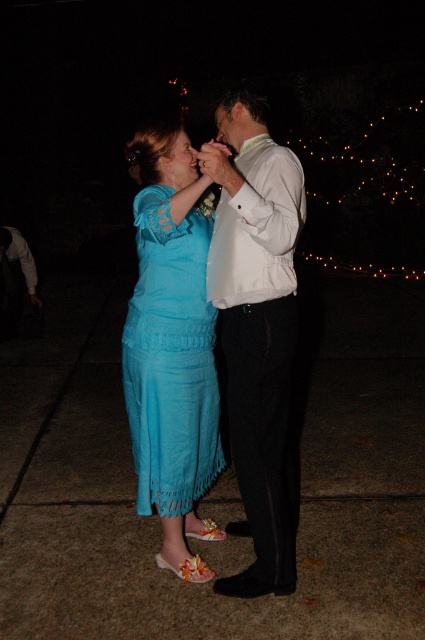
Question: Which point is farther from the camera taking this photo?

Choices:
 (A) (226, 266)
 (B) (141, 380)
 (C) (295, 205)

Answer: (B)

Question: Is white satin shirt at center closer to camera compared to white satin dress shirt at center?

Choices:
 (A) yes
 (B) no

Answer: (B)

Question: Is turquoise fabric dress at center bigger than white satin dress shirt at center?

Choices:
 (A) yes
 (B) no

Answer: (A)

Question: Does turquoise fabric dress at center have a lesser width compared to white satin dress shirt at center?

Choices:
 (A) no
 (B) yes

Answer: (A)

Question: Which point is farther to the camera?

Choices:
 (A) (125, 349)
 (B) (286, 189)
 (C) (243, 424)

Answer: (A)

Question: Which of these objects is positioned farthest from the white satin dress shirt at center?

Choices:
 (A) turquoise fabric dress at center
 (B) white satin shirt at center

Answer: (A)